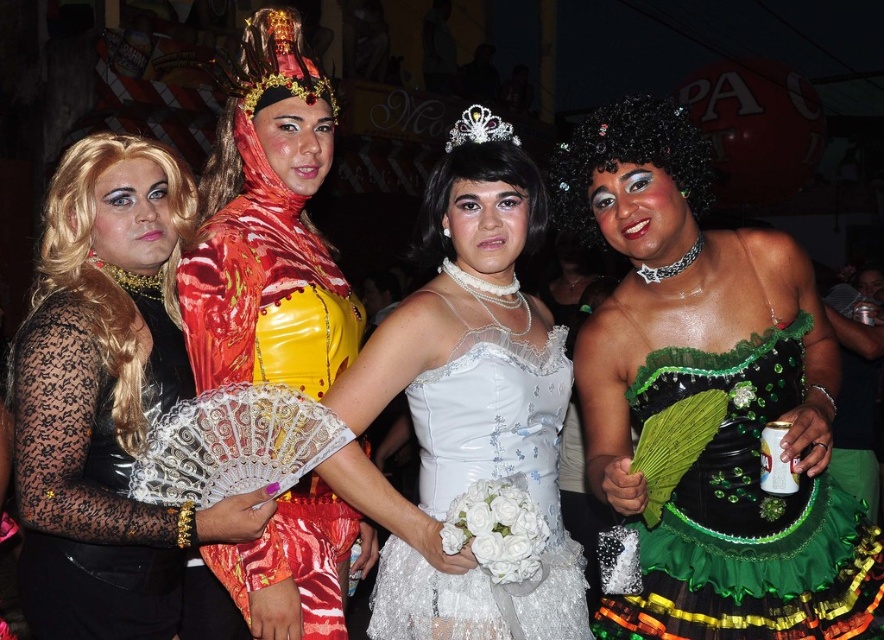
What is the exact coordinate of the shiny red fabric at center?

The shiny red fabric at center is located at point (x=268, y=227).

You are a photographer at the event and want to capture a photo of both the black lace dress at left and the shiny metallic fan at center. Which object should you focus on first to ensure it appears larger in the photo?

The shiny metallic fan at center should be focused on first because it is taller than the black lace dress at left, making it appear larger in the photo.